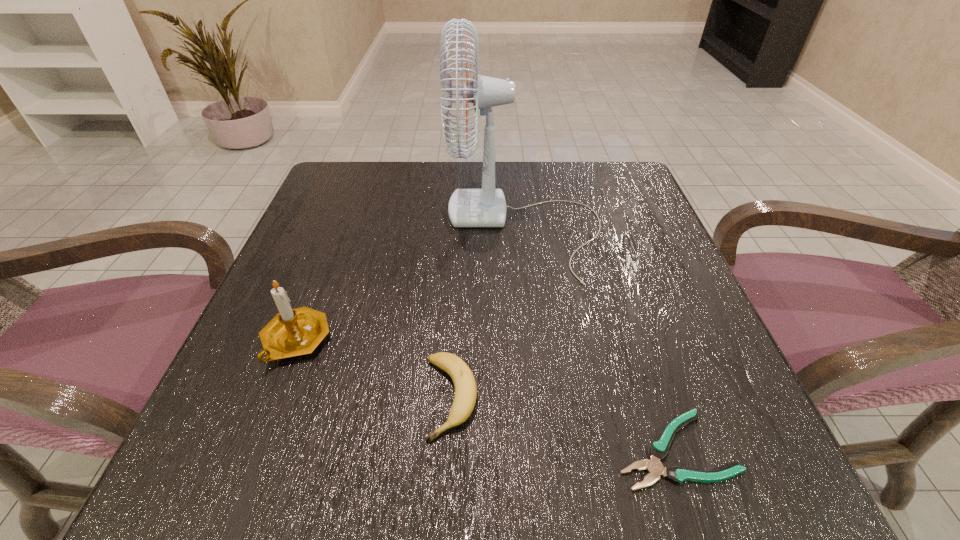
Find the location of a particular element. This screenshot has width=960, height=540. free point between the leftmost object and the banana is located at coordinates (373, 369).

Find the location of a particular element. The image size is (960, 540). free space between the tallest object and the pliers is located at coordinates (599, 339).

Locate an element on the screen. The width and height of the screenshot is (960, 540). unoccupied area between the banana and the shortest object is located at coordinates (563, 423).

Locate an element on the screen. The width and height of the screenshot is (960, 540). free spot between the banana and the pliers is located at coordinates (563, 423).

I want to click on vacant space in between the third shortest object and the farthest object, so click(410, 284).

This screenshot has width=960, height=540. Find the location of `vacant area between the farthest object and the banana`. vacant area between the farthest object and the banana is located at coordinates (488, 312).

Locate which object ranks second in proximity to the second shortest object. Please provide its 2D coordinates. Your answer should be formatted as a tuple, i.e. [(x, y)], where the tuple contains the x and y coordinates of a point satisfying the conditions above.

[(468, 208)]

Identify which object is the third closest to the banana. Please provide its 2D coordinates. Your answer should be formatted as a tuple, i.e. [(x, y)], where the tuple contains the x and y coordinates of a point satisfying the conditions above.

[(658, 450)]

The width and height of the screenshot is (960, 540). In order to click on blank space that satisfies the following two spatial constraints: 1. on the front-facing side of the fan; 2. on the back side of the shortest object in this screenshot , I will do `click(551, 449)`.

At what (x,y) coordinates should I click in order to perform the action: click on free space that satisfies the following two spatial constraints: 1. on the front side of the pliers; 2. on the right side of the third shortest object. Please return your answer as a coordinate pair (x, y). Image resolution: width=960 pixels, height=540 pixels. Looking at the image, I should click on (253, 449).